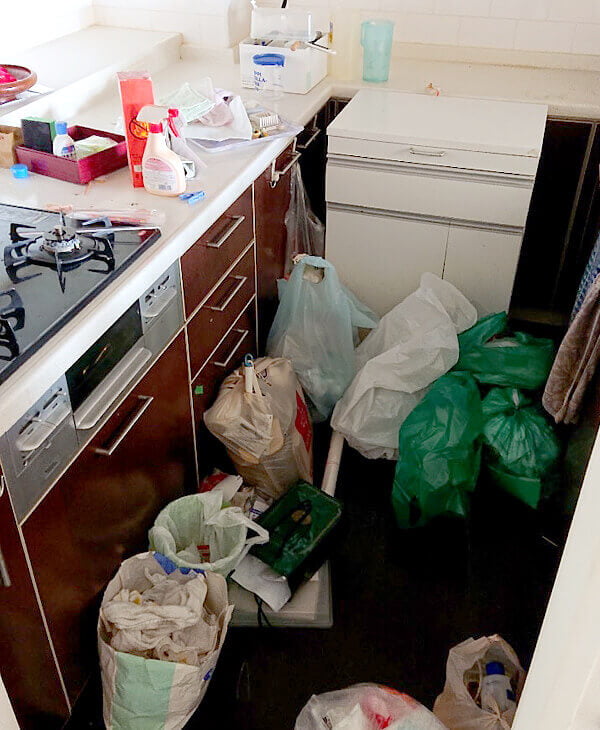
I want to click on white counter top, so click(185, 215).